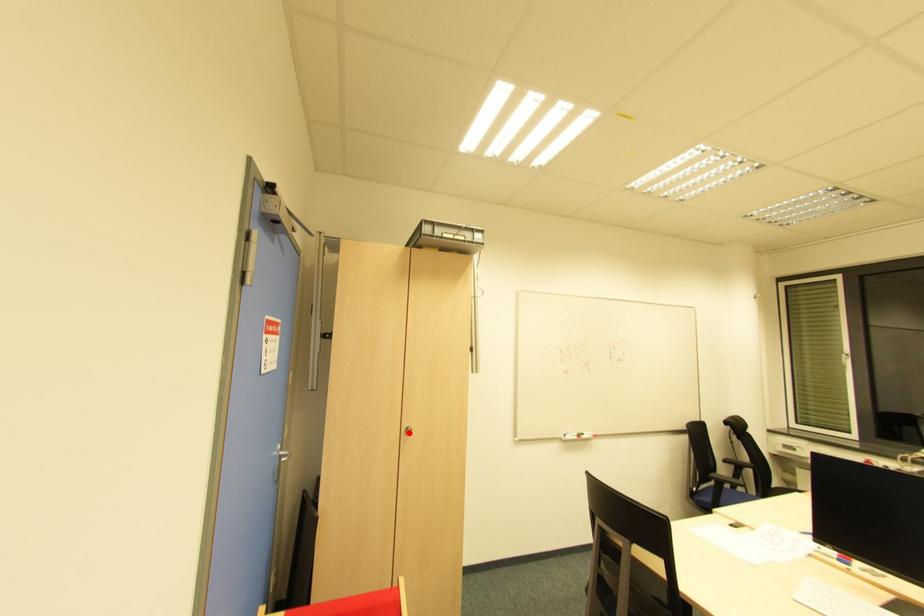
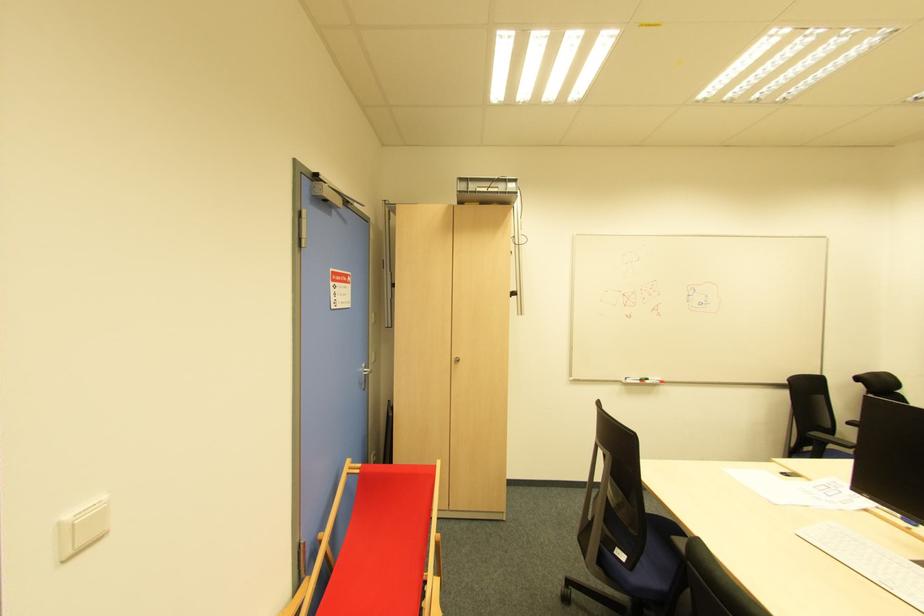
In the second image, find the point that corresponds to the highlighted location in the first image.

(457, 362)